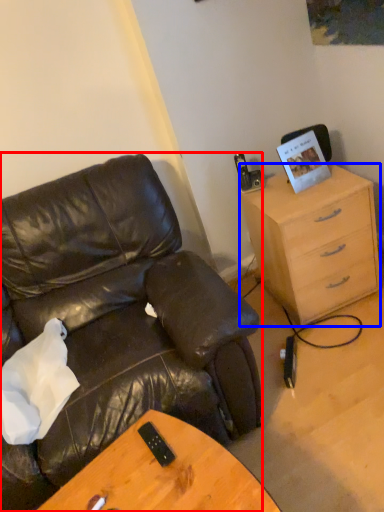
Question: Which object is closer to the camera taking this photo, chair (highlighted by a red box) or cabinetry (highlighted by a blue box)?

Choices:
 (A) chair
 (B) cabinetry

Answer: (A)